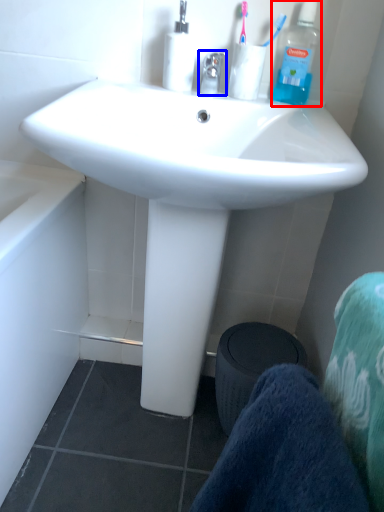
Question: Among these objects, which one is nearest to the camera, bottle (highlighted by a red box) or faucet (highlighted by a blue box)?

Choices:
 (A) bottle
 (B) faucet

Answer: (B)